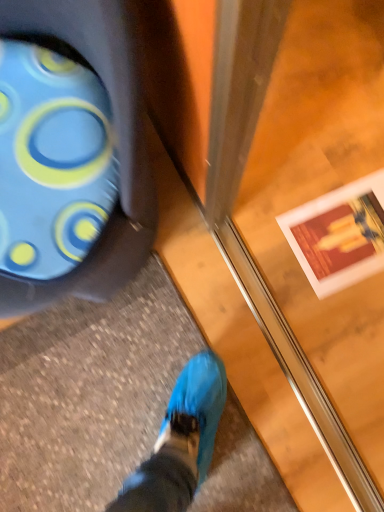
Image resolution: width=384 pixels, height=512 pixels. I want to click on vacant space underneath transparent glass screen door at center (from a real-world perspective), so click(278, 333).